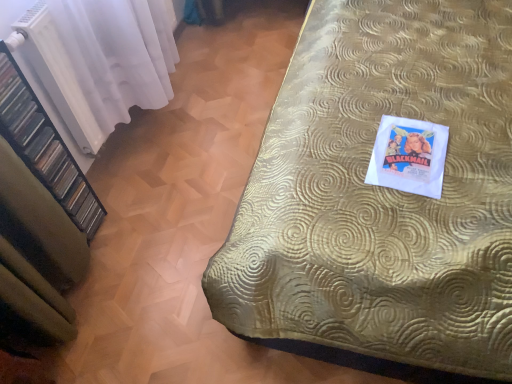
Question: Does gold textured bedspread at upper right have a smaller size compared to black plastic shelf at left?

Choices:
 (A) yes
 (B) no

Answer: (B)

Question: Can you confirm if gold textured bedspread at upper right is wider than black plastic shelf at left?

Choices:
 (A) no
 (B) yes

Answer: (B)

Question: Is the depth of gold textured bedspread at upper right less than that of black plastic shelf at left?

Choices:
 (A) no
 (B) yes

Answer: (A)

Question: Is gold textured bedspread at upper right to the left of black plastic shelf at left from the viewer's perspective?

Choices:
 (A) yes
 (B) no

Answer: (B)

Question: Is gold textured bedspread at upper right to the right of black plastic shelf at left from the viewer's perspective?

Choices:
 (A) no
 (B) yes

Answer: (B)

Question: From their relative heights in the image, would you say white sheer curtain at left is taller or shorter than black plastic shelf at left?

Choices:
 (A) tall
 (B) short

Answer: (B)

Question: Is point (36, 56) positioned closer to the camera than point (55, 162)?

Choices:
 (A) farther
 (B) closer

Answer: (B)

Question: Is white sheer curtain at left wider or thinner than black plastic shelf at left?

Choices:
 (A) thin
 (B) wide

Answer: (A)

Question: From the image's perspective, is white sheer curtain at left located above or below black plastic shelf at left?

Choices:
 (A) below
 (B) above

Answer: (B)

Question: Is black plastic shelf at left bigger or smaller than white sheer curtain at left?

Choices:
 (A) big
 (B) small

Answer: (B)

Question: Choose the correct answer: Is black plastic shelf at left inside white sheer curtain at left or outside it?

Choices:
 (A) inside
 (B) outside

Answer: (B)

Question: From the image's perspective, is black plastic shelf at left above or below white sheer curtain at left?

Choices:
 (A) above
 (B) below

Answer: (B)

Question: In terms of height, does black plastic shelf at left look taller or shorter compared to white sheer curtain at left?

Choices:
 (A) short
 (B) tall

Answer: (B)

Question: Based on their sizes in the image, would you say gold textured bedspread at upper right is bigger or smaller than black plastic shelf at left?

Choices:
 (A) big
 (B) small

Answer: (A)

Question: From a real-world perspective, is gold textured bedspread at upper right above or below black plastic shelf at left?

Choices:
 (A) below
 (B) above

Answer: (A)